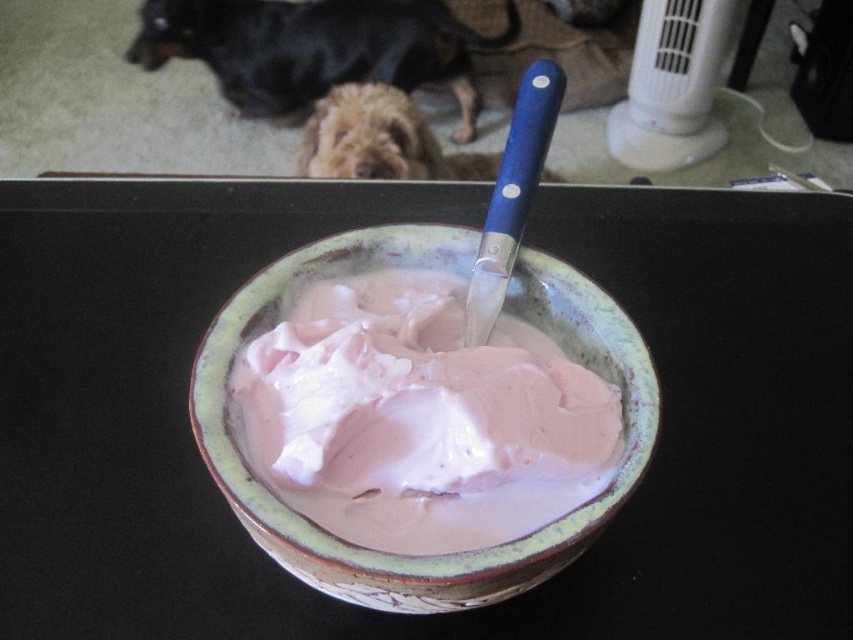
In the scene shown: You are standing in the kitchen and see a bowl with a creamy pink substance. There are two points marked in the image. The first point is at coordinate (701, 276) and the second is at (345, 0). If you were to draw a straight line from your current position to the first point, would it pass closer to the second point compared to the first?

Point (701, 276) is in front of point (345, 0), so drawing a straight line to the first point would pass closer to the second point because the first point is closer to your viewpoint.

You are a chef who needs to retrieve the black fur dog at upper left from the kitchen. The pink glazed bowl at center contains hot soup. Is there enough space between the two to safely move the dog without spilling the soup?

The pink glazed bowl at center and the black fur dog at upper left are 17.41 inches apart. Since 17.41 inches is a sufficient distance to move the dog safely without risking the soup, the chef can move the dog without spilling.